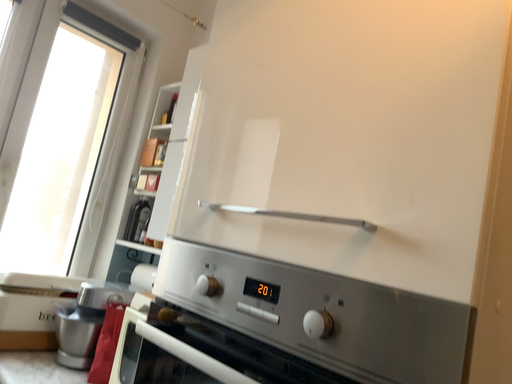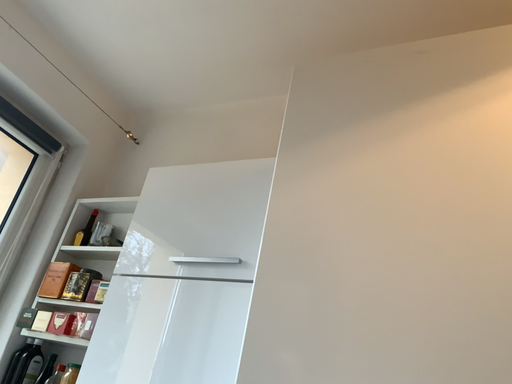
Question: Which way did the camera rotate in the video?

Choices:
 (A) rotated right
 (B) rotated left

Answer: (A)